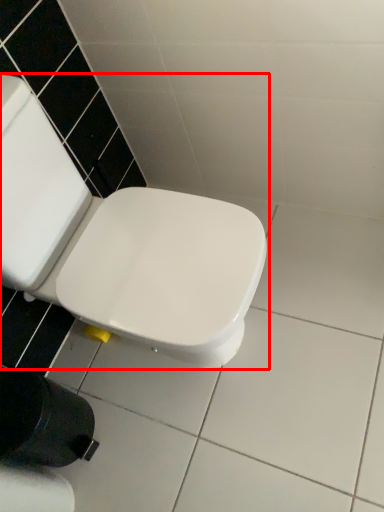
Question: In this image, where is toilet (annotated by the red box) located relative to toilet paper?

Choices:
 (A) right
 (B) left

Answer: (A)